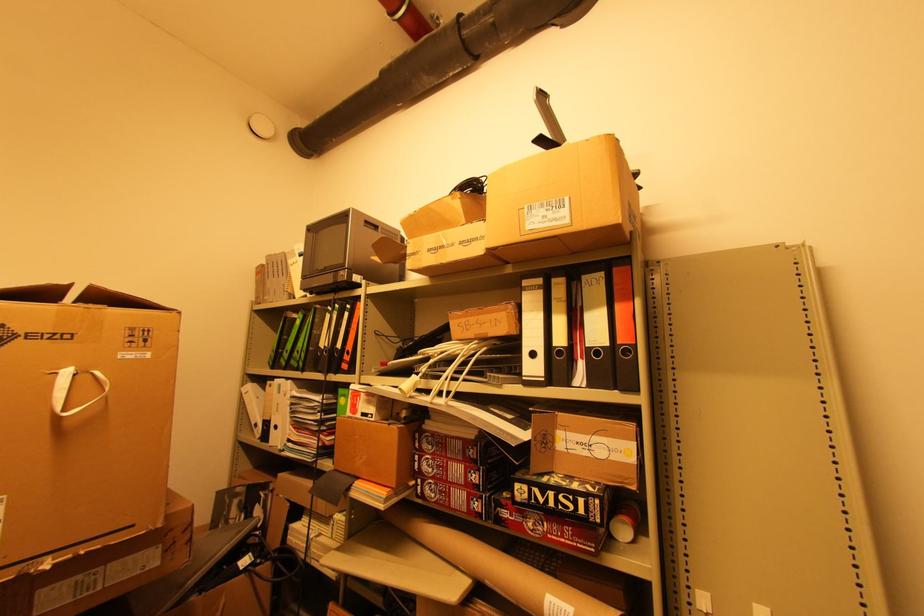
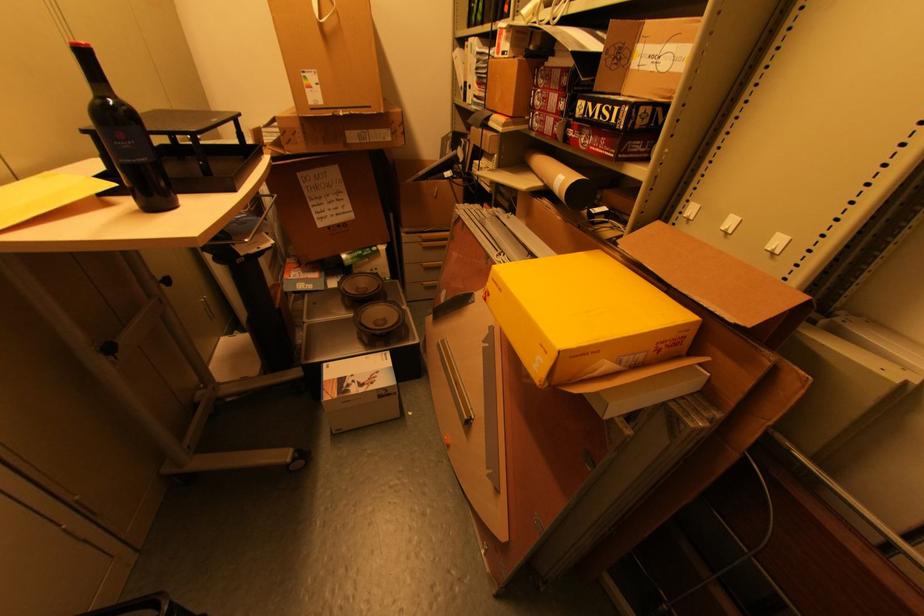
Based on the photo, how did the camera likely rotate?

The camera rotated toward left-down.